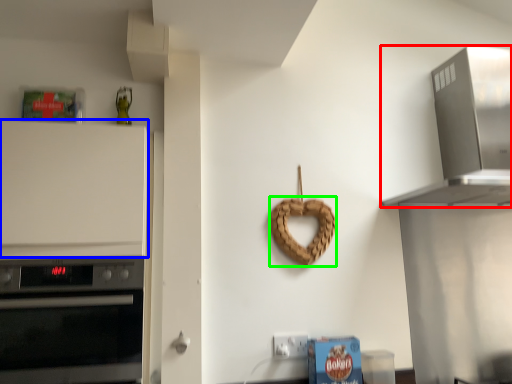
Question: Which object is the farthest from home appliance (highlighted by a red box)? Choose among these: cabinetry (highlighted by a blue box) or pretzel (highlighted by a green box).

Choices:
 (A) cabinetry
 (B) pretzel

Answer: (A)